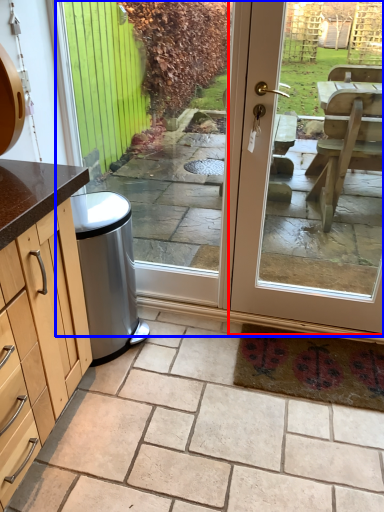
Question: Which point is further to the camera, door (highlighted by a red box) or screen door (highlighted by a blue box)?

Choices:
 (A) door
 (B) screen door

Answer: (B)